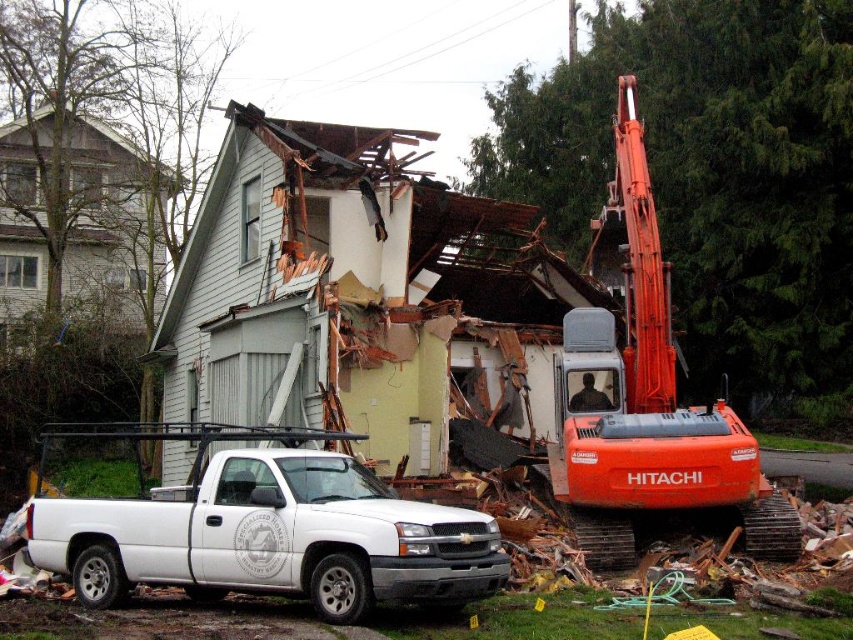
You are a construction worker standing at the edge of the demolition site. You need to move the white matte truck at lower left to a safer location away from the falling debris. Since the truck can only move forward and backward, can you maneuver it out without moving around the orange metallic excavator at center?

The white matte truck at lower left is positioned on the left side of the orange metallic excavator at center. Since the truck can only move forward and backward, it can move straight back away from the excavator without needing to go around it because it is already positioned to the side.

You are a construction worker who needs to transport heavy equipment from the orange metallic excavator at center to the white matte truck at lower left. Considering their sizes, which vehicle can carry more of the equipment?

The white matte truck at lower left has a larger size compared to the orange metallic excavator at center, so it can carry more equipment.

You are standing at the point labeled as point (265, 529) in the image. What object is located at that point?

The point (265, 529) indicates the white matte truck at lower left.